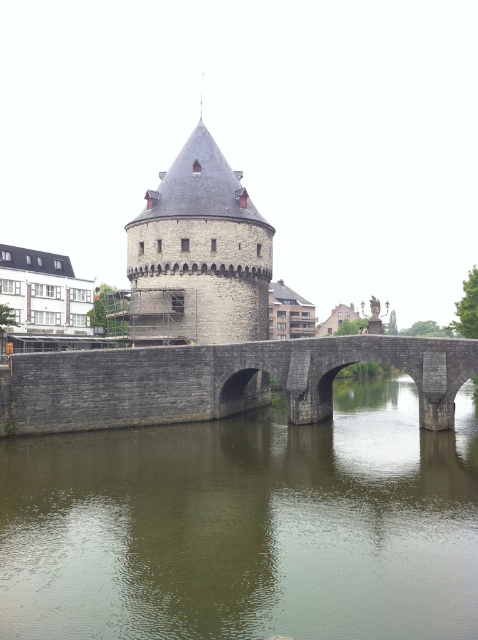
Question: Is greenish stone water at center above gray stone bridge at center?

Choices:
 (A) yes
 (B) no

Answer: (B)

Question: Does gray stone bridge at center have a larger size compared to gray stone tower at center?

Choices:
 (A) no
 (B) yes

Answer: (B)

Question: Which point appears farthest from the camera in this image?

Choices:
 (A) (253, 440)
 (B) (235, 353)
 (C) (238, 336)

Answer: (C)

Question: Is greenish stone water at center positioned before gray stone tower at center?

Choices:
 (A) yes
 (B) no

Answer: (A)

Question: Which object is positioned closest to the gray stone tower at center?

Choices:
 (A) gray stone bridge at center
 (B) greenish stone water at center

Answer: (A)

Question: Which point is farther from the camera taking this photo?

Choices:
 (A) (228, 458)
 (B) (204, 200)

Answer: (B)